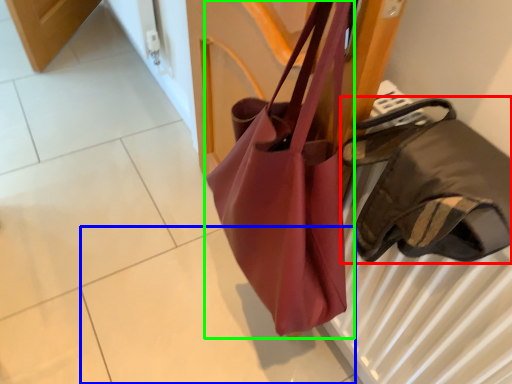
Question: Considering the real-world distances, which object is closest to handbag (highlighted by a red box)? tile (highlighted by a blue box) or handbag (highlighted by a green box).

Choices:
 (A) tile
 (B) handbag

Answer: (B)